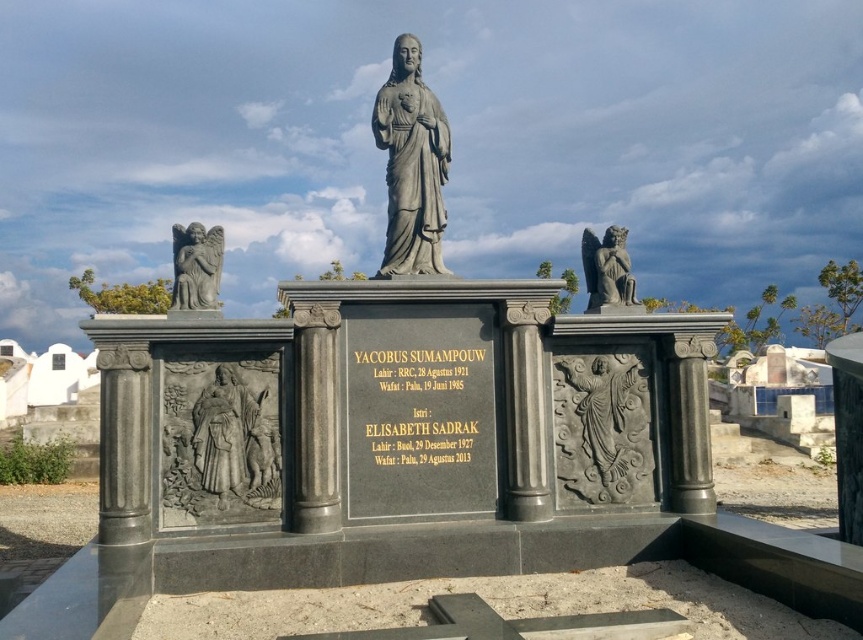
Question: Among these points, which one is nearest to the camera?

Choices:
 (A) (209, 273)
 (B) (225, 438)
 (C) (596, 273)
 (D) (413, 234)

Answer: (B)

Question: Is gray stone angel at right above gray stone angel at left?

Choices:
 (A) no
 (B) yes

Answer: (A)

Question: Which point is closer to the camera taking this photo?

Choices:
 (A) (200, 266)
 (B) (404, 35)

Answer: (A)

Question: Among these objects, which one is nearest to the camera?

Choices:
 (A) gray stone statue at center
 (B) gray stone angel at right
 (C) gray stone angel at left

Answer: (C)

Question: Is gray stone angel at right to the left of gray stone angel at left from the viewer's perspective?

Choices:
 (A) no
 (B) yes

Answer: (A)

Question: Where is gray stone statue at center located in relation to slate gray stone angel at upper right in the image?

Choices:
 (A) left
 (B) right

Answer: (A)